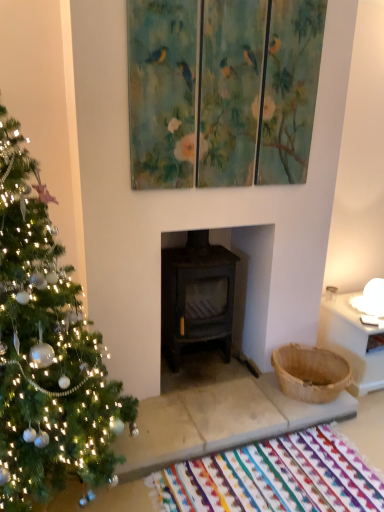
Question: Is multicolored woven mat at lower center taller than green matte christmas tree at left?

Choices:
 (A) no
 (B) yes

Answer: (A)

Question: Is multicolored woven mat at lower center thinner than green matte christmas tree at left?

Choices:
 (A) yes
 (B) no

Answer: (A)

Question: Can you confirm if multicolored woven mat at lower center is shorter than green matte christmas tree at left?

Choices:
 (A) yes
 (B) no

Answer: (A)

Question: Is multicolored woven mat at lower center bigger than green matte christmas tree at left?

Choices:
 (A) no
 (B) yes

Answer: (A)

Question: Does multicolored woven mat at lower center have a smaller size compared to green matte christmas tree at left?

Choices:
 (A) no
 (B) yes

Answer: (B)

Question: From a real-world perspective, is green matte christmas tree at left positioned above or below multicolored woven mat at lower center?

Choices:
 (A) above
 (B) below

Answer: (A)

Question: In terms of height, does green matte christmas tree at left look taller or shorter compared to multicolored woven mat at lower center?

Choices:
 (A) tall
 (B) short

Answer: (A)

Question: In the image, is green matte christmas tree at left positioned in front of or behind multicolored woven mat at lower center?

Choices:
 (A) front
 (B) behind

Answer: (A)

Question: In terms of size, does green matte christmas tree at left appear bigger or smaller than multicolored woven mat at lower center?

Choices:
 (A) small
 (B) big

Answer: (B)

Question: From the image's perspective, is green matte christmas tree at left above or below painted wood triptych at upper center?

Choices:
 (A) below
 (B) above

Answer: (A)

Question: From a real-world perspective, is green matte christmas tree at left physically located above or below painted wood triptych at upper center?

Choices:
 (A) above
 (B) below

Answer: (B)

Question: Is green matte christmas tree at left spatially inside painted wood triptych at upper center, or outside of it?

Choices:
 (A) inside
 (B) outside

Answer: (B)

Question: Looking at their shapes, would you say green matte christmas tree at left is wider or thinner than painted wood triptych at upper center?

Choices:
 (A) wide
 (B) thin

Answer: (A)

Question: Looking at the image, does multicolored woven mat at lower center seem bigger or smaller compared to painted wood triptych at upper center?

Choices:
 (A) small
 (B) big

Answer: (A)

Question: Considering the positions of multicolored woven mat at lower center and painted wood triptych at upper center in the image, is multicolored woven mat at lower center wider or thinner than painted wood triptych at upper center?

Choices:
 (A) thin
 (B) wide

Answer: (B)